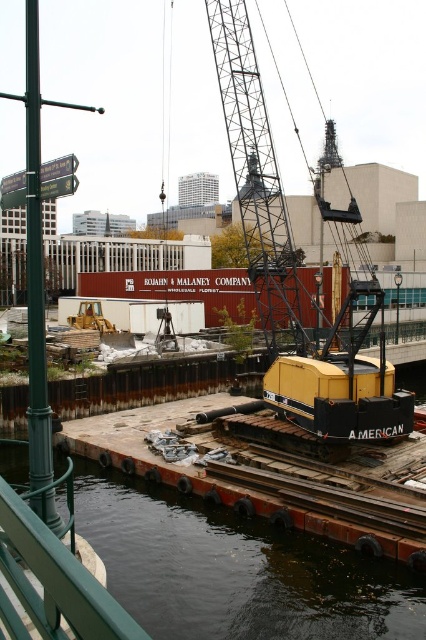
Is dark water at lower left shorter than yellow metallic crane at center?

Yes, dark water at lower left is shorter than yellow metallic crane at center.

Is dark water at lower left to the right of yellow metallic crane at center from the viewer's perspective?

No, dark water at lower left is not to the right of yellow metallic crane at center.

Which is in front, point (376, 636) or point (351, 289)?

Point (376, 636) is more forward.

Identify the location of dark water at lower left. (236, 570).